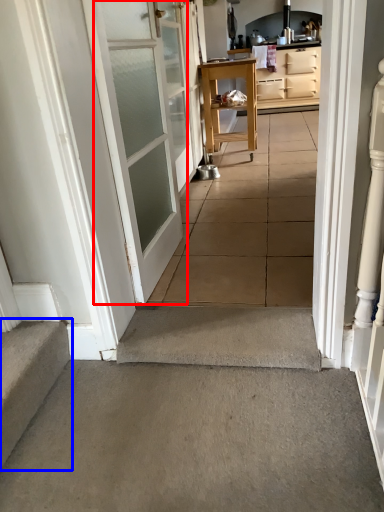
Question: Which of the following is the farthest to the observer, door (highlighted by a red box) or stairs (highlighted by a blue box)?

Choices:
 (A) door
 (B) stairs

Answer: (A)